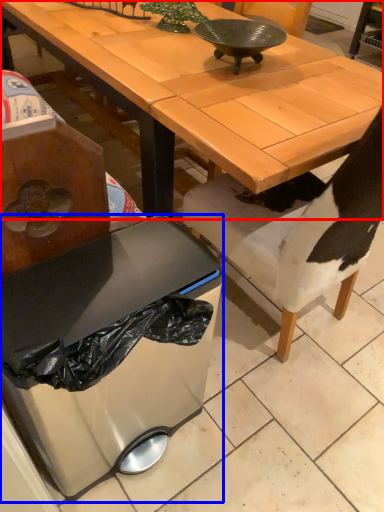
Question: Which object appears farthest to the camera in this image, desk (highlighted by a red box) or trash bin/can (highlighted by a blue box)?

Choices:
 (A) desk
 (B) trash bin/can

Answer: (A)